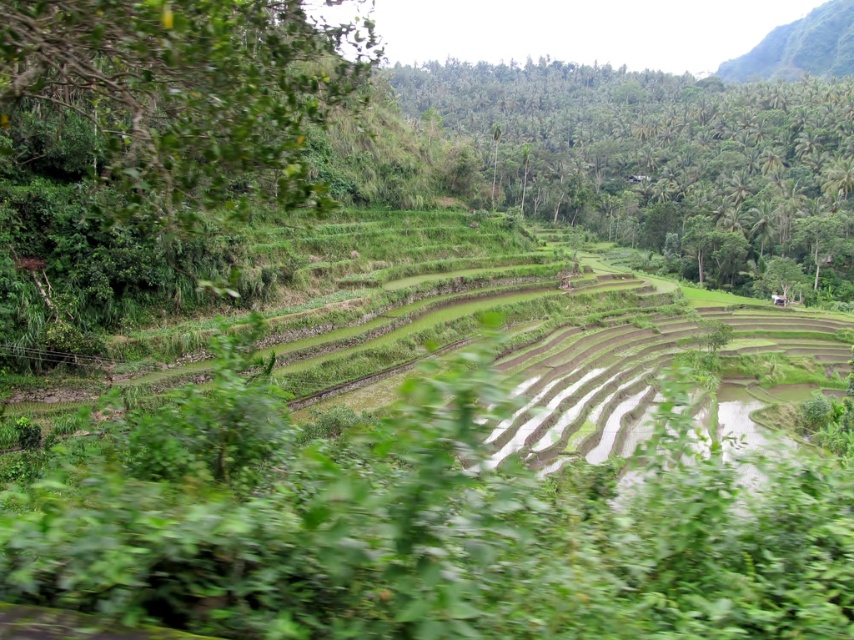
You are standing at the bottom of the terraced rice paddies and looking up. There is a point marked at coordinate (664, 160) in the image. What can you see at that point?

At the point marked by coordinate (664, 160), you can see green leafy trees at upper center.

You are a hiker standing at the bottom of the terraced rice paddies and looking towards the green leafy trees at upper center and the green leafy hillside at upper right. Which of these two objects appears taller from your vantage point?

The green leafy trees at upper center appears taller than the green leafy hillside at upper right from your vantage point.